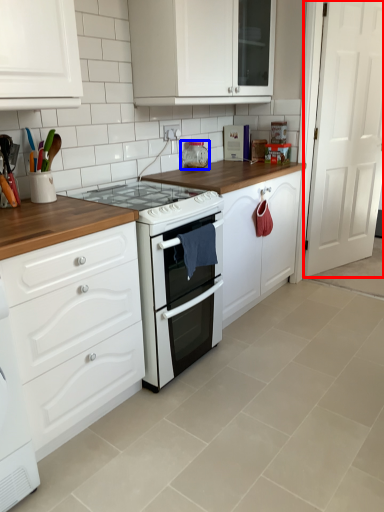
Question: Among these objects, which one is farthest to the camera, door (highlighted by a red box) or appliance (highlighted by a blue box)?

Choices:
 (A) door
 (B) appliance

Answer: (B)